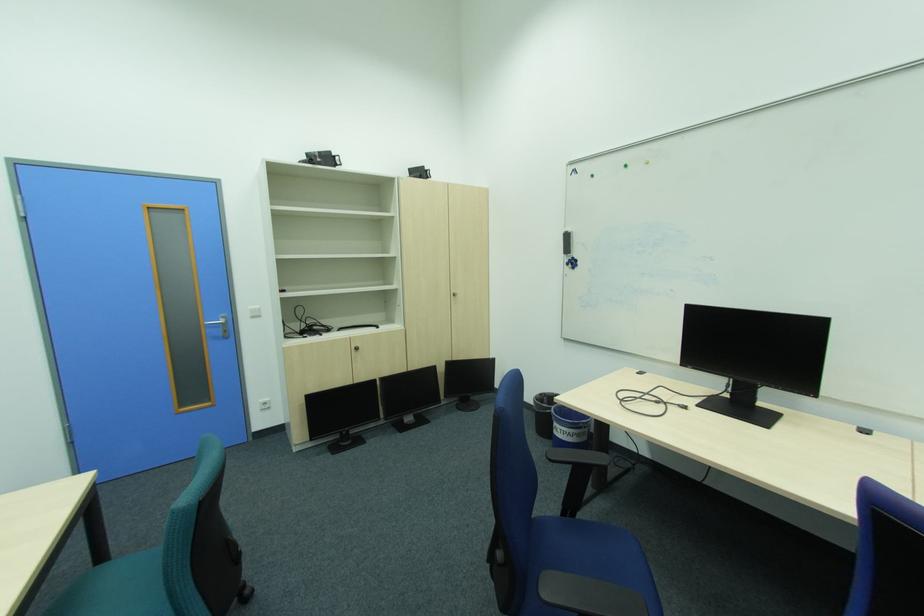
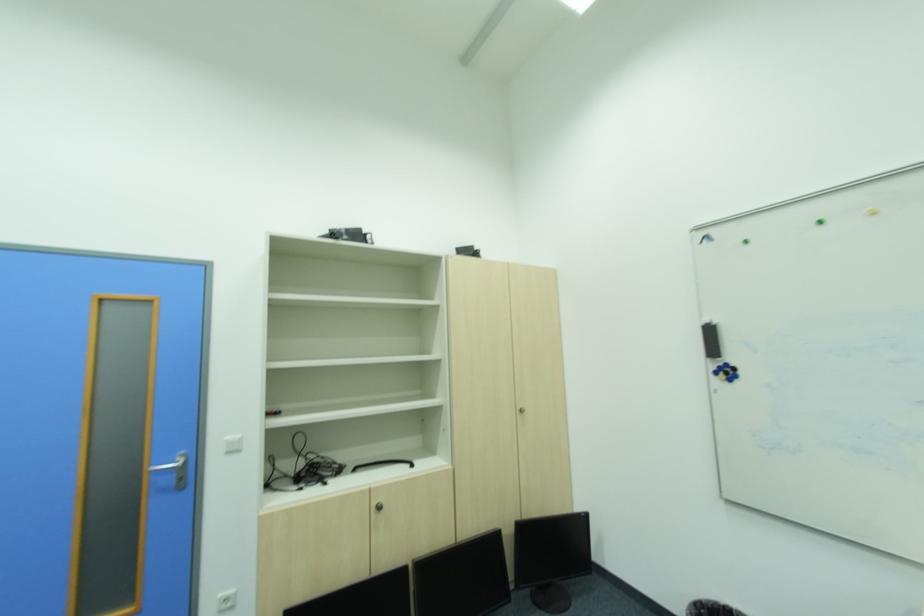
Locate, in the second image, the point that corresponds to point 579,264 in the first image.

(736, 371)